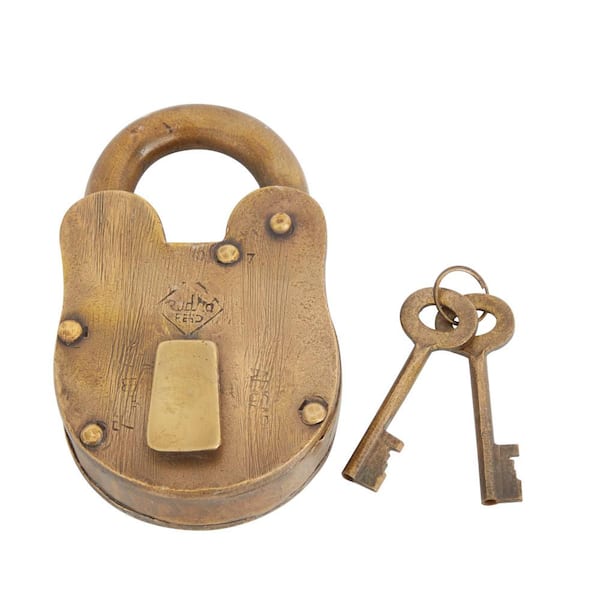
The width and height of the screenshot is (600, 600). I want to click on top of lock, so click(x=252, y=141), click(x=125, y=147).